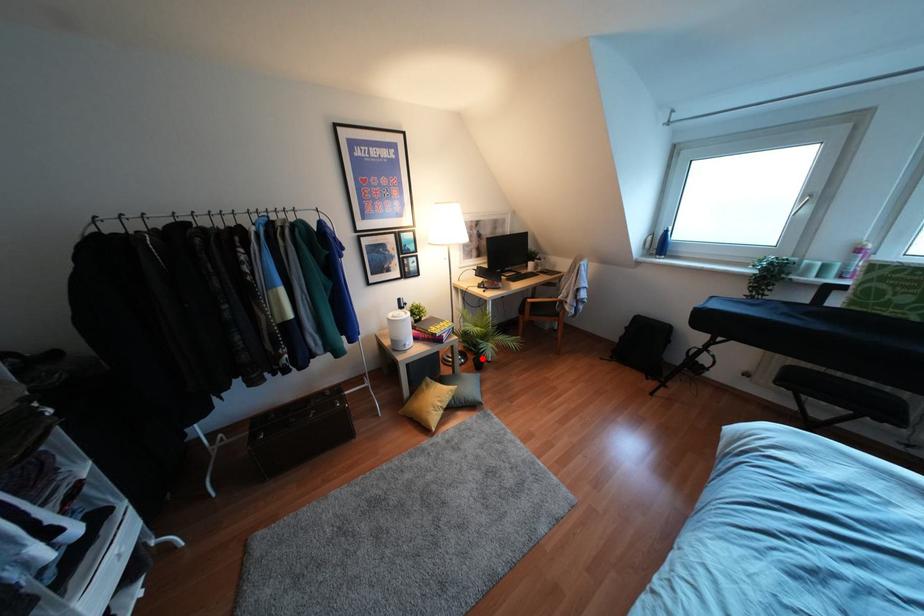
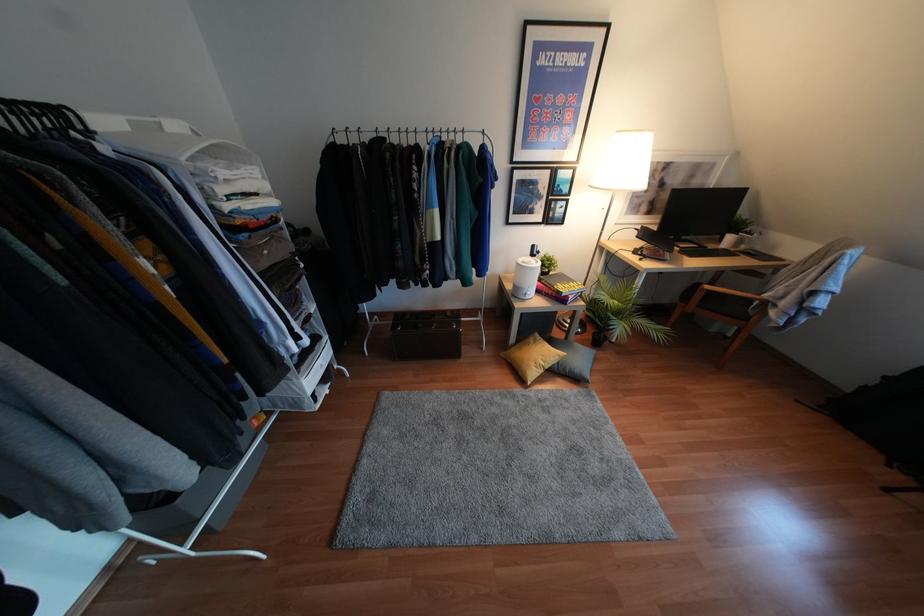
Question: I am providing you with two images of the same scene from different viewpoints. In image1, a red point is highlighted. Considering the same 3D point in image2, which of the following is correct?

Choices:
 (A) It is closer
 (B) It is farther

Answer: (A)